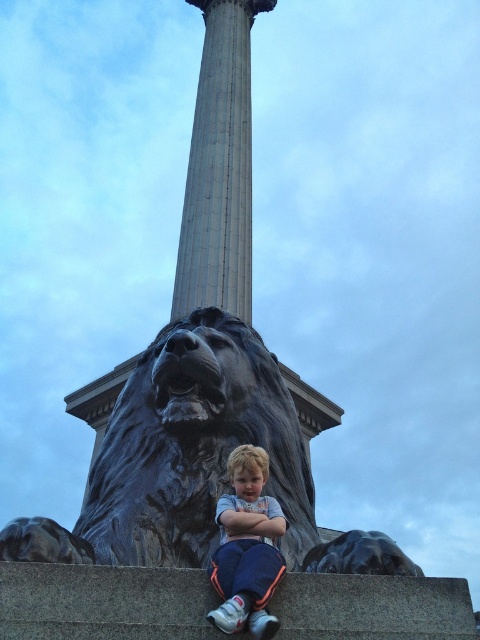
Question: Which of these objects is positioned farthest from the polished bronze lion at center?

Choices:
 (A) gray marble column at center
 (B) light blue t-shirt at center

Answer: (A)

Question: Which object is the closest to the gray marble column at center?

Choices:
 (A) polished bronze lion at center
 (B) light blue t-shirt at center

Answer: (A)

Question: Can you confirm if gray marble column at center is positioned to the left of light blue t-shirt at center?

Choices:
 (A) yes
 (B) no

Answer: (A)

Question: Is gray marble column at center below light blue t-shirt at center?

Choices:
 (A) yes
 (B) no

Answer: (B)

Question: Is gray marble column at center above light blue t-shirt at center?

Choices:
 (A) yes
 (B) no

Answer: (A)

Question: Which object is positioned closest to the light blue t-shirt at center?

Choices:
 (A) gray marble column at center
 (B) polished bronze lion at center

Answer: (B)